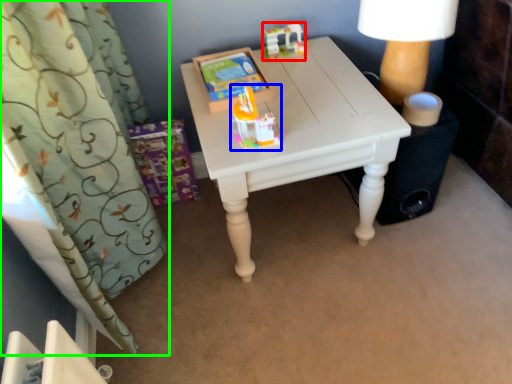
Question: Which object is positioned farthest from toy (highlighted by a red box)? Select from toy (highlighted by a blue box) and curtain (highlighted by a green box).

Choices:
 (A) toy
 (B) curtain

Answer: (B)